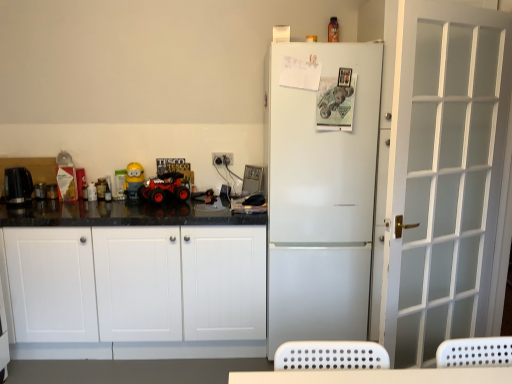
Question: Can we say white frosted glass door at right lies outside rubberized red toy car at center?

Choices:
 (A) no
 (B) yes

Answer: (B)

Question: From a real-world perspective, is white frosted glass door at right physically below rubberized red toy car at center?

Choices:
 (A) yes
 (B) no

Answer: (A)

Question: From the image's perspective, does white frosted glass door at right appear lower than rubberized red toy car at center?

Choices:
 (A) yes
 (B) no

Answer: (A)

Question: Is there a large distance between white frosted glass door at right and rubberized red toy car at center?

Choices:
 (A) no
 (B) yes

Answer: (B)

Question: Is white frosted glass door at right positioned behind rubberized red toy car at center?

Choices:
 (A) yes
 (B) no

Answer: (B)

Question: Is white matte refrigerator at center taller or shorter than black plastic kettle at left, which ranks as the 2th appliance in front-to-back order?

Choices:
 (A) short
 (B) tall

Answer: (B)

Question: From a real-world perspective, is white matte refrigerator at center positioned above or below black plastic kettle at left, which ranks as the 2th appliance in front-to-back order?

Choices:
 (A) above
 (B) below

Answer: (B)

Question: From the image's perspective, relative to black plastic kettle at left, which ranks as the 2th appliance in front-to-back order, is white matte refrigerator at center above or below?

Choices:
 (A) above
 (B) below

Answer: (B)

Question: Considering the positions of point pos(328,331) and point pos(37,195), is point pos(328,331) closer or farther from the camera than point pos(37,195)?

Choices:
 (A) farther
 (B) closer

Answer: (B)

Question: Is white frosted glass door at right inside or outside of white matte cabinet at left?

Choices:
 (A) inside
 (B) outside

Answer: (B)

Question: Is white frosted glass door at right taller or shorter than white matte cabinet at left?

Choices:
 (A) tall
 (B) short

Answer: (A)

Question: From the image's perspective, is white frosted glass door at right above or below white matte cabinet at left?

Choices:
 (A) above
 (B) below

Answer: (A)

Question: From a real-world perspective, is white frosted glass door at right above or below white matte cabinet at left?

Choices:
 (A) below
 (B) above

Answer: (B)

Question: Considering the positions of black plastic kettle at left, which ranks as the 2th appliance in front-to-back order, and white matte refrigerator at center in the image, is black plastic kettle at left, which ranks as the 2th appliance in front-to-back order, taller or shorter than white matte refrigerator at center?

Choices:
 (A) short
 (B) tall

Answer: (A)

Question: Is black plastic kettle at left, which ranks as the 2th appliance in front-to-back order, wider or thinner than white matte refrigerator at center?

Choices:
 (A) thin
 (B) wide

Answer: (A)